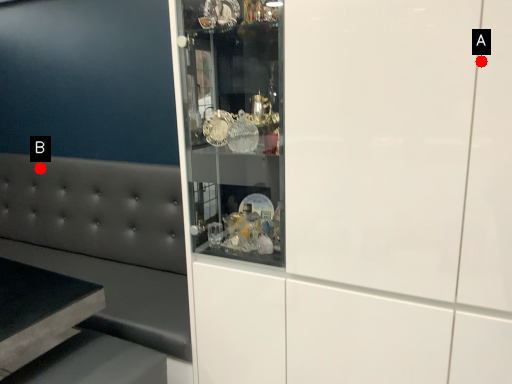
Question: Two points are circled on the image, labeled by A and B beside each circle. Which point is further to the camera?

Choices:
 (A) A is further
 (B) B is further

Answer: (B)